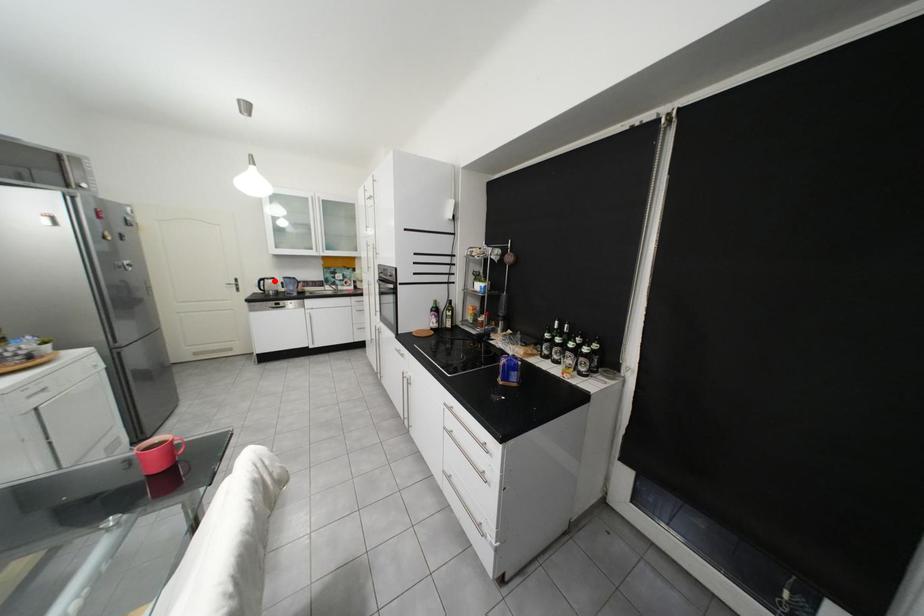
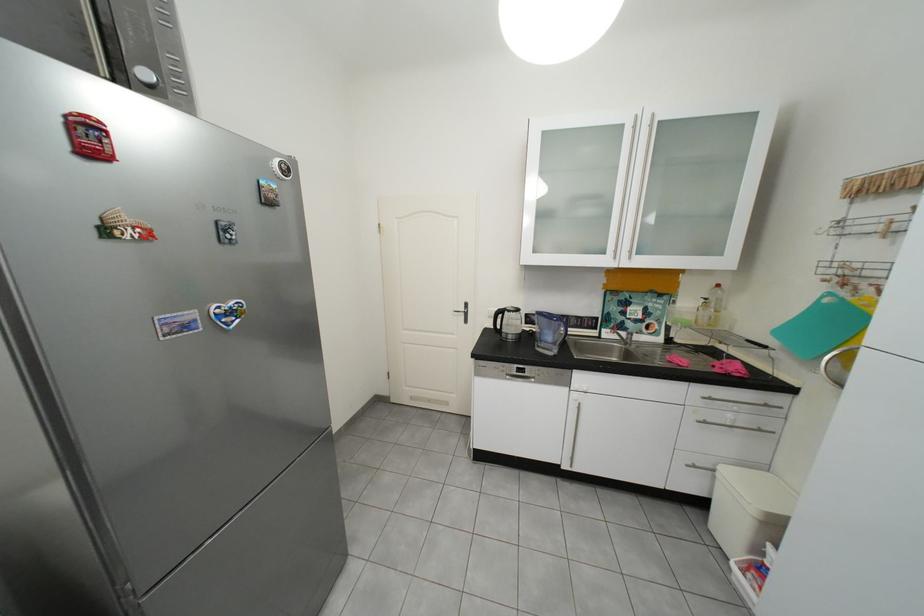
The point at the highlighted location is marked in the first image. Where is the corresponding point in the second image?

(513, 313)